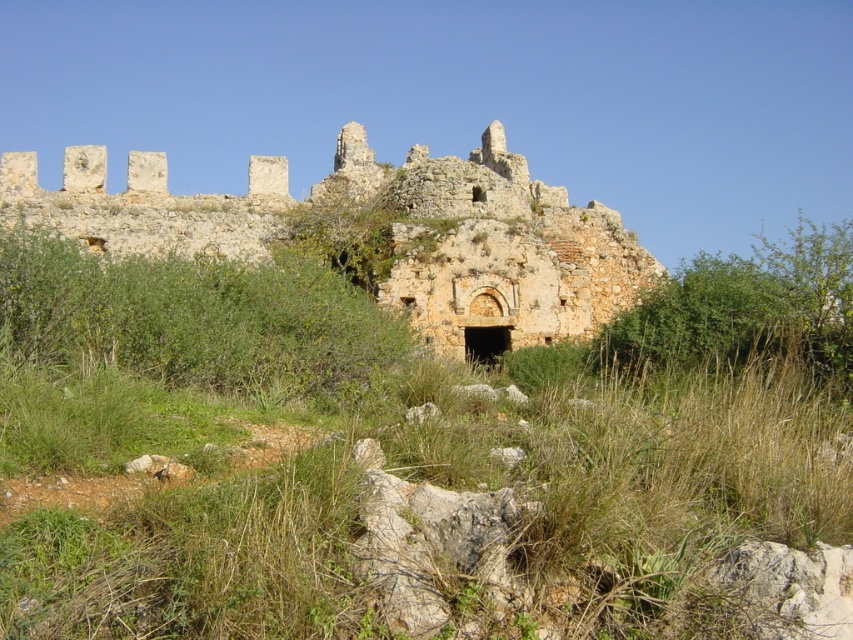
Question: Does green grass at center have a larger size compared to green leafy bush at center?

Choices:
 (A) no
 (B) yes

Answer: (B)

Question: Is green grass at center behind rustic stone castle at center?

Choices:
 (A) yes
 (B) no

Answer: (B)

Question: Can you confirm if green grass at center is smaller than rustic stone castle at center?

Choices:
 (A) yes
 (B) no

Answer: (A)

Question: Which object is positioned farthest from the green leafy bush at center?

Choices:
 (A) rustic stone castle at center
 (B) green grass at center

Answer: (B)

Question: Which of these objects is positioned farthest from the rustic stone castle at center?

Choices:
 (A) green grass at center
 (B) green leafy bush at center

Answer: (A)

Question: Among these objects, which one is nearest to the camera?

Choices:
 (A) green grass at center
 (B) rustic stone castle at center
 (C) green leafy bush at center

Answer: (A)